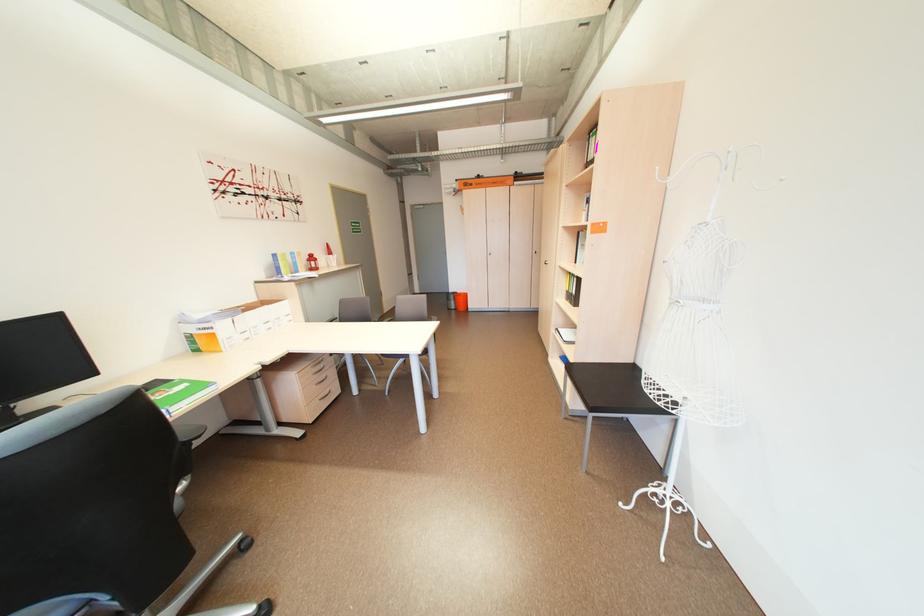
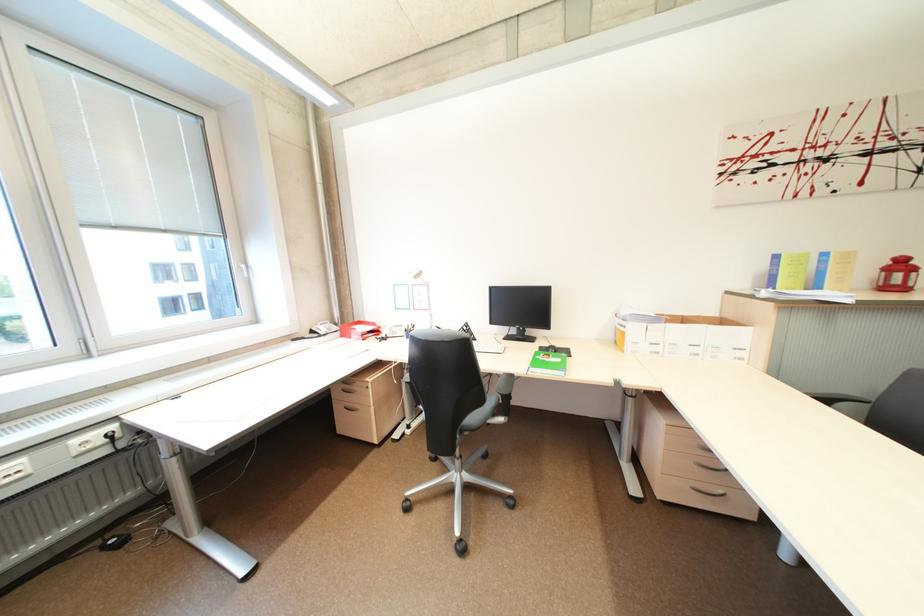
Where in the second image is the point corresponding to point (321, 259) from the first image?

(910, 265)